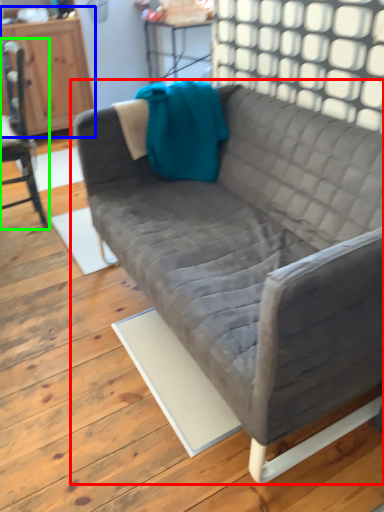
Question: Which object is the farthest from studio couch (highlighted by a red box)? Choose among these: dresser (highlighted by a blue box) or chair (highlighted by a green box).

Choices:
 (A) dresser
 (B) chair

Answer: (A)